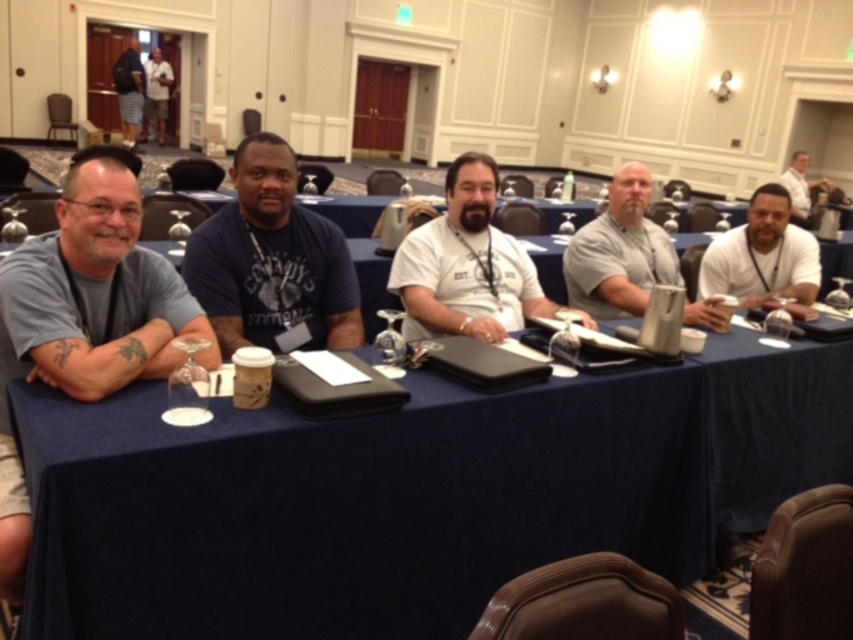
Between gray matte mug at center and white matte shirt at center, which one has less height?

Standing shorter between the two is white matte shirt at center.

Is gray matte mug at center further to camera compared to white matte shirt at center?

No, gray matte mug at center is in front of white matte shirt at center.

Is point (590, 243) farther from camera compared to point (796, 268)?

No, it is not.

Find the location of a particular element. gray matte mug at center is located at coordinates (619, 252).

Who is more forward, (636, 225) or (801, 202)?

Positioned in front is point (636, 225).

Consider the image. Between gray matte mug at center and white shirt at upper right, which one has more height?

white shirt at upper right

The height and width of the screenshot is (640, 853). Identify the location of gray matte mug at center. (619, 252).

This screenshot has height=640, width=853. I want to click on gray matte mug at center, so click(619, 252).

Between dark blue t-shirt at upper left and white shirt at upper right, which one is positioned lower?

Positioned lower is white shirt at upper right.

Is dark blue t-shirt at upper left positioned in front of white shirt at upper right?

No, it is not.

What do you see at coordinates (129, 92) in the screenshot?
I see `dark blue t-shirt at upper left` at bounding box center [129, 92].

I want to click on dark blue t-shirt at upper left, so click(129, 92).